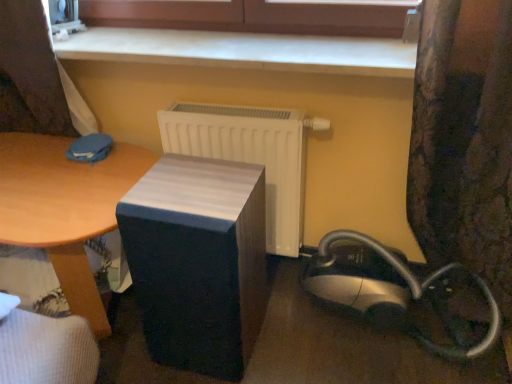
Question: Can you confirm if white matte radiator at center is taller than silver/black plastic vacuum cleaner at lower right?

Choices:
 (A) yes
 (B) no

Answer: (A)

Question: Can you see white matte radiator at center touching silver/black plastic vacuum cleaner at lower right?

Choices:
 (A) yes
 (B) no

Answer: (B)

Question: Is white matte radiator at center thinner than silver/black plastic vacuum cleaner at lower right?

Choices:
 (A) yes
 (B) no

Answer: (A)

Question: Considering the relative sizes of white matte radiator at center and silver/black plastic vacuum cleaner at lower right in the image provided, is white matte radiator at center bigger than silver/black plastic vacuum cleaner at lower right?

Choices:
 (A) no
 (B) yes

Answer: (A)

Question: Is white matte radiator at center at the right side of silver/black plastic vacuum cleaner at lower right?

Choices:
 (A) yes
 (B) no

Answer: (B)

Question: Is white matte radiator at center to the left of silver/black plastic vacuum cleaner at lower right from the viewer's perspective?

Choices:
 (A) yes
 (B) no

Answer: (A)

Question: Does smooth white surface at upper center appear on the right side of floral fabric curtain at right?

Choices:
 (A) yes
 (B) no

Answer: (B)

Question: Considering the relative sizes of smooth white surface at upper center and floral fabric curtain at right in the image provided, is smooth white surface at upper center wider than floral fabric curtain at right?

Choices:
 (A) yes
 (B) no

Answer: (B)

Question: Is smooth white surface at upper center closer to the viewer compared to floral fabric curtain at right?

Choices:
 (A) yes
 (B) no

Answer: (B)

Question: Considering the relative sizes of smooth white surface at upper center and floral fabric curtain at right in the image provided, is smooth white surface at upper center smaller than floral fabric curtain at right?

Choices:
 (A) no
 (B) yes

Answer: (B)

Question: Is smooth white surface at upper center at the left side of floral fabric curtain at right?

Choices:
 (A) no
 (B) yes

Answer: (B)

Question: Can you confirm if smooth white surface at upper center is taller than floral fabric curtain at right?

Choices:
 (A) yes
 (B) no

Answer: (B)

Question: Considering the relative positions of matte black speaker at center and floral fabric curtain at right in the image provided, is matte black speaker at center to the right of floral fabric curtain at right from the viewer's perspective?

Choices:
 (A) yes
 (B) no

Answer: (B)